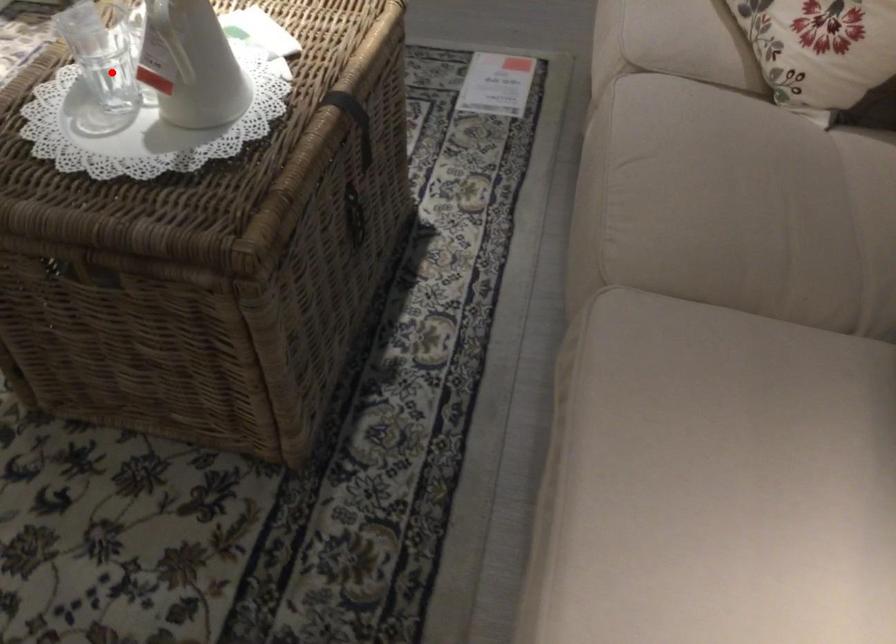
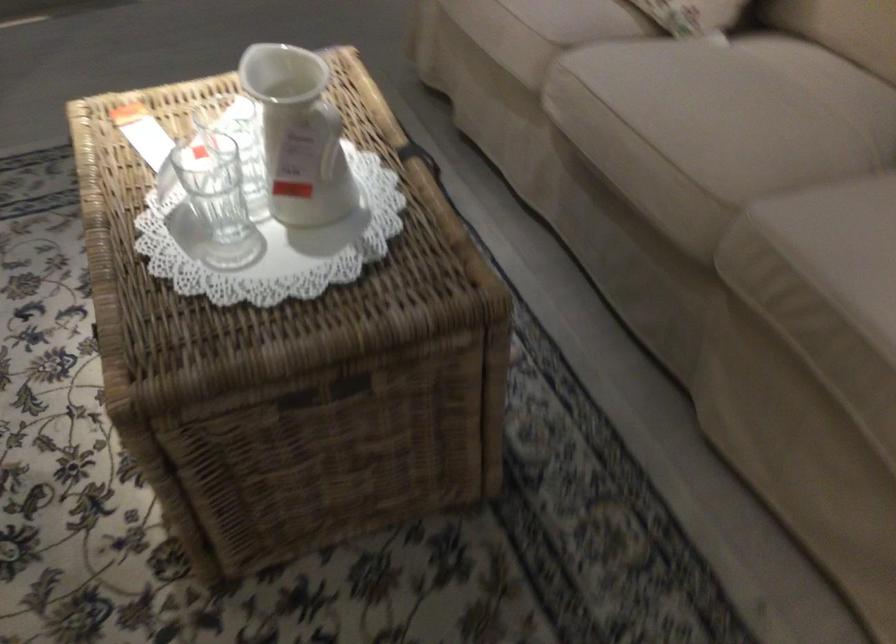
In the second image, find the point that corresponds to the highlighted location in the first image.

(212, 205)